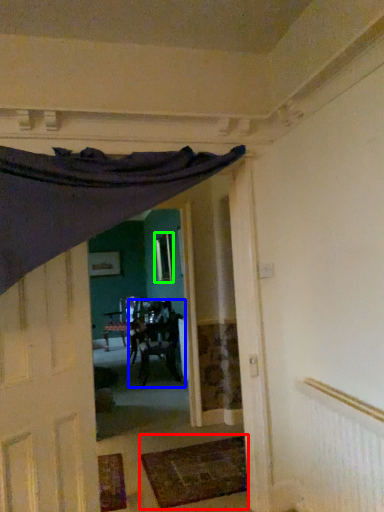
Question: Which object is positioned closest to mat (highlighted by a red box)? Select from chair (highlighted by a blue box) and window (highlighted by a green box).

Choices:
 (A) chair
 (B) window

Answer: (A)